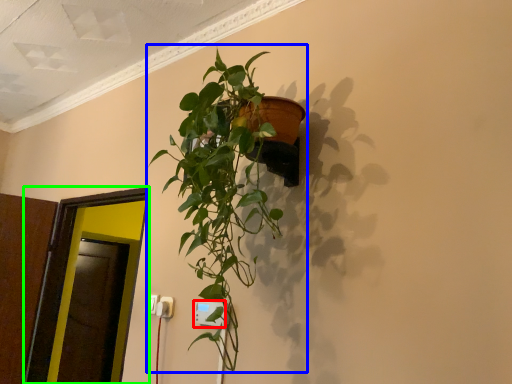
Question: Based on their relative distances, which object is nearer to electric outlet (highlighted by a red box)? Choose from houseplant (highlighted by a blue box) and glass door (highlighted by a green box).

Choices:
 (A) houseplant
 (B) glass door

Answer: (A)